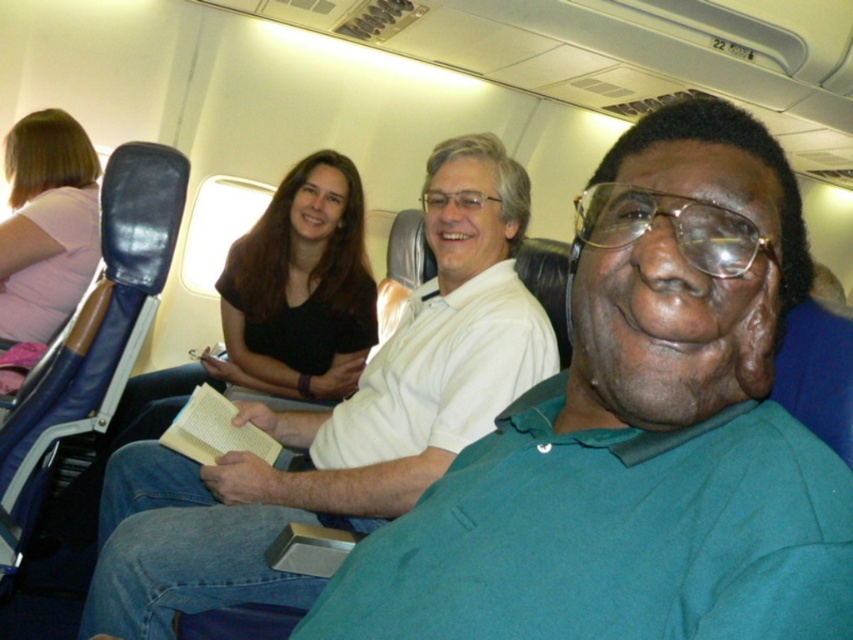
Who is positioned more to the left, green matte shirt at center or white matte shirt at center?

Positioned to the left is white matte shirt at center.

Is point (824, 509) farther from viewer compared to point (236, 573)?

No.

The image size is (853, 640). Find the location of `green matte shirt at center`. green matte shirt at center is located at coordinates (637, 433).